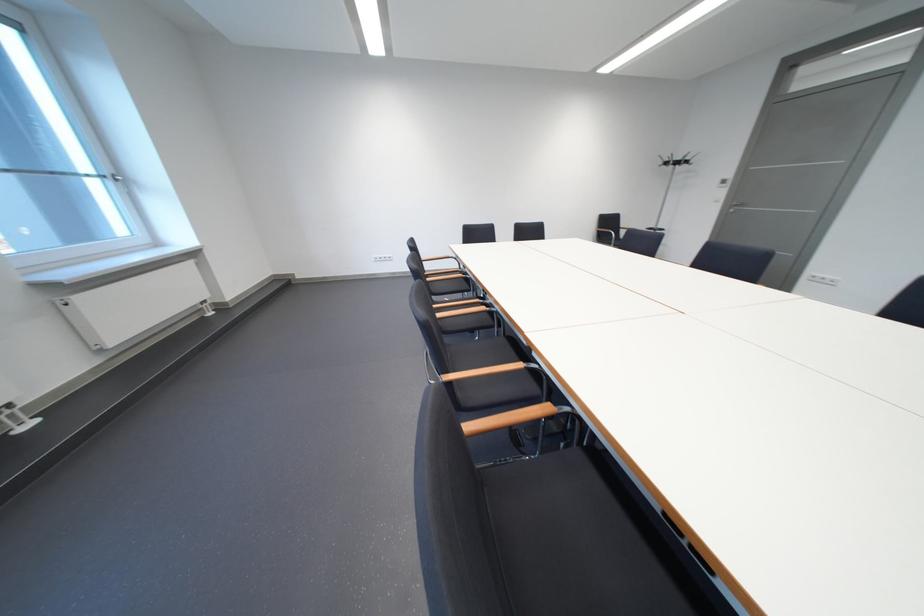
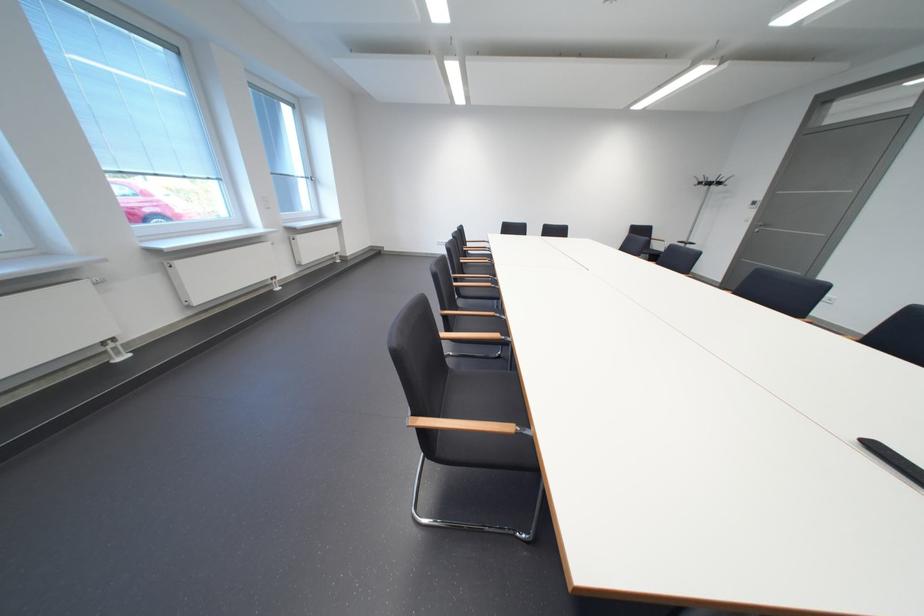
What movement of the cameraman would produce the second image?

The movement direction of the cameraman is right, backward.